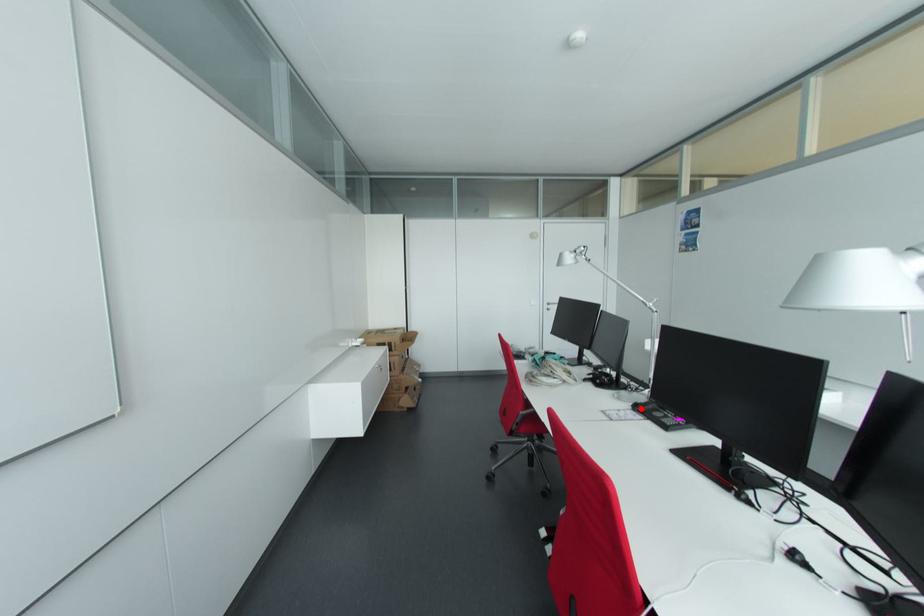
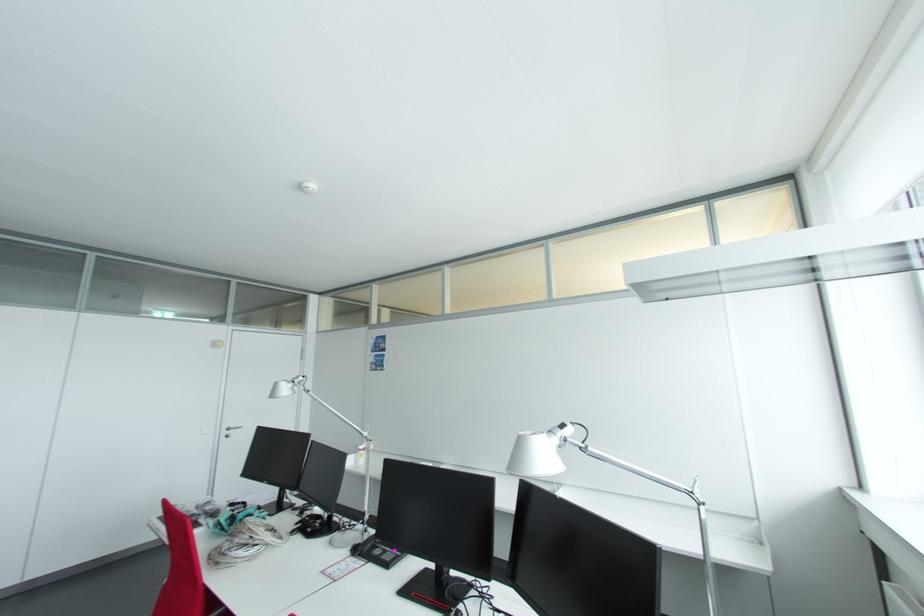
In the second image, find the point that corresponds to the highlighted location in the first image.

(359, 552)